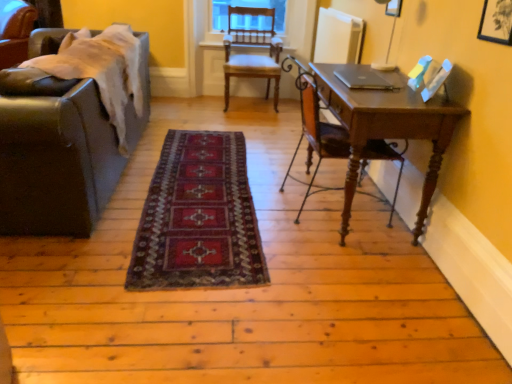
Question: Should I look upward or downward to see leather couch at left, marked as the first chair in a left-to-right arrangement?

Choices:
 (A) up
 (B) down

Answer: (A)

Question: Is leather couch at left, which is counted as the 3th chair, starting from the front, facing towards wooden chair at center, the 2th chair when ordered from left to right?

Choices:
 (A) yes
 (B) no

Answer: (B)

Question: Is leather couch at left, the third chair positioned from the right, in front of wooden chair at center, the 2th chair when ordered from left to right?

Choices:
 (A) no
 (B) yes

Answer: (A)

Question: Considering the relative positions of leather couch at left, the third chair positioned from the right, and wooden chair at center, which appears as the 2th chair when viewed from the front, in the image provided, is leather couch at left, the third chair positioned from the right, to the left of wooden chair at center, which appears as the 2th chair when viewed from the front, from the viewer's perspective?

Choices:
 (A) yes
 (B) no

Answer: (A)

Question: Is leather couch at left, which appears as the first chair when viewed from the back, facing away from wooden chair at center, which is the 2th chair in right-to-left order?

Choices:
 (A) no
 (B) yes

Answer: (A)

Question: From the image's perspective, is leather couch at left, which appears as the first chair when viewed from the back, on top of wooden chair at center, which appears as the 2th chair when viewed from the front?

Choices:
 (A) yes
 (B) no

Answer: (A)

Question: Is leather couch at left, which is counted as the 3th chair, starting from the front, completely or partially outside of wooden chair at center, which is the 2th chair in right-to-left order?

Choices:
 (A) no
 (B) yes

Answer: (B)

Question: Would you say wooden desk at right is a long distance from leather couch at left?

Choices:
 (A) no
 (B) yes

Answer: (B)

Question: Would you say wooden desk at right contains leather couch at left?

Choices:
 (A) no
 (B) yes

Answer: (A)

Question: Is wooden desk at right in contact with leather couch at left?

Choices:
 (A) yes
 (B) no

Answer: (B)

Question: Is wooden desk at right not within leather couch at left?

Choices:
 (A) no
 (B) yes

Answer: (B)

Question: Considering the relative sizes of wooden desk at right and leather couch at left in the image provided, is wooden desk at right bigger than leather couch at left?

Choices:
 (A) no
 (B) yes

Answer: (A)

Question: Does wooden desk at right appear on the right side of leather couch at left?

Choices:
 (A) yes
 (B) no

Answer: (A)

Question: Could you tell me if wooden desk at right is turned towards wooden chair at right, marked as the third chair in a back-to-front arrangement?

Choices:
 (A) yes
 (B) no

Answer: (A)